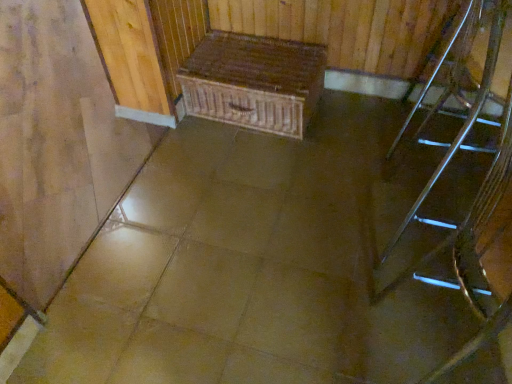
Identify the location of unoccupied region to the right of wooden chest at center. (356, 124).